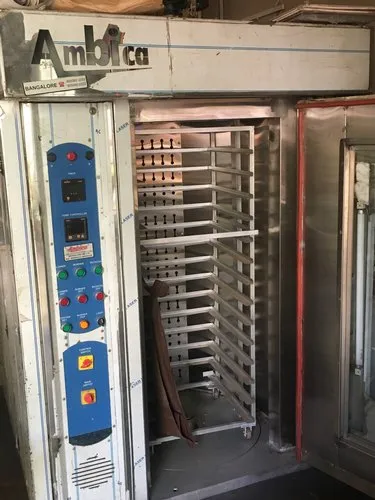
The height and width of the screenshot is (500, 375). What are the coordinates of `large machine - looks like oven` in the screenshot? It's located at (218, 62).